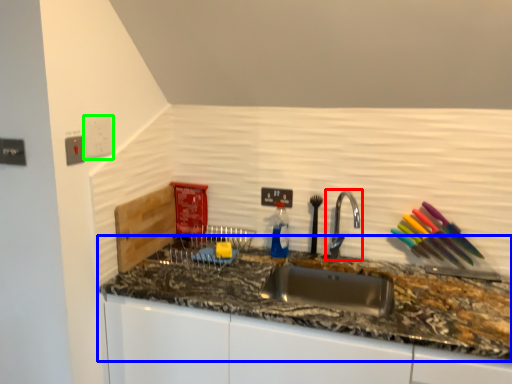
Question: Which is nearer to the tap (highlighted by a red box)? countertop (highlighted by a blue box) or electric outlet (highlighted by a green box).

Choices:
 (A) countertop
 (B) electric outlet

Answer: (A)